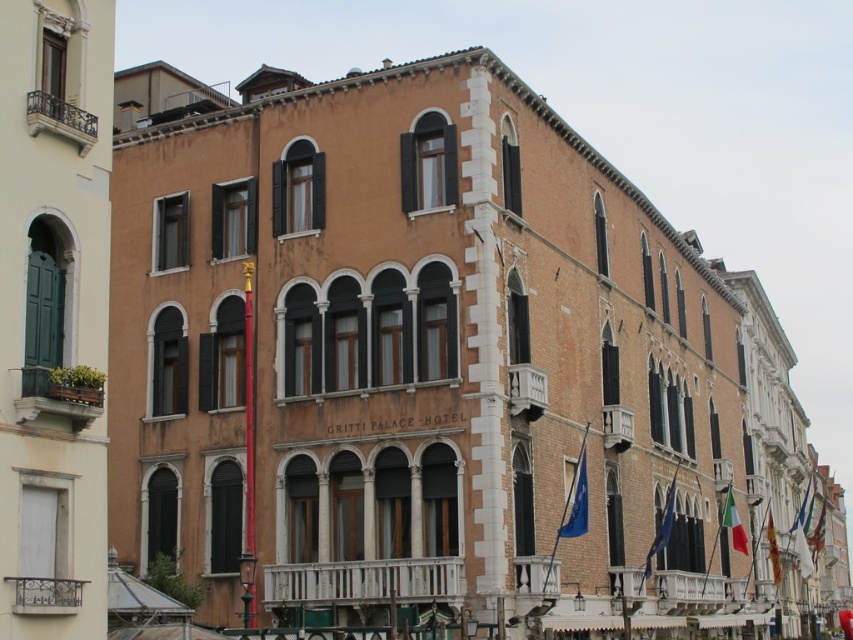
Question: From the image, what is the correct spatial relationship of italian flag at center in relation to italian flag at right?

Choices:
 (A) above
 (B) below

Answer: (A)

Question: Which object is closer to the camera taking this photo?

Choices:
 (A) blue fabric flag at lower right
 (B) blue fabric flag at lower center
 (C) italian flag at center
 (D) green fabric flag at lower right

Answer: (B)

Question: From the image, what is the correct spatial relationship of blue fabric flag at lower center in relation to italian flag at right?

Choices:
 (A) left
 (B) right

Answer: (A)

Question: Which object appears farthest from the camera in this image?

Choices:
 (A) blue fabric flag at lower right
 (B) italian flag at right
 (C) italian flag at center

Answer: (B)

Question: Which point appears farthest from the camera in this image?

Choices:
 (A) (665, 513)
 (B) (723, 525)
 (C) (566, 522)

Answer: (B)

Question: Is blue fabric flag at lower right further to the viewer compared to italian flag at center?

Choices:
 (A) no
 (B) yes

Answer: (A)